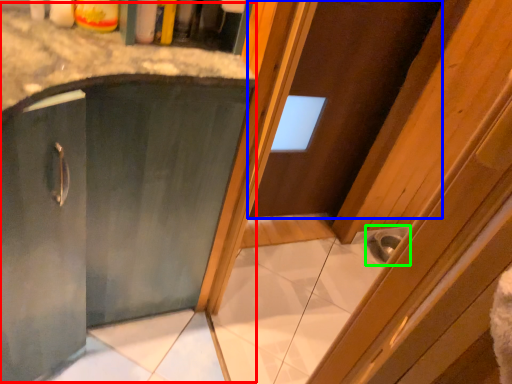
Question: Which object is positioned farthest from cabinetry (highlighted by a red box)? Select from door (highlighted by a blue box) and sink (highlighted by a green box).

Choices:
 (A) door
 (B) sink

Answer: (B)